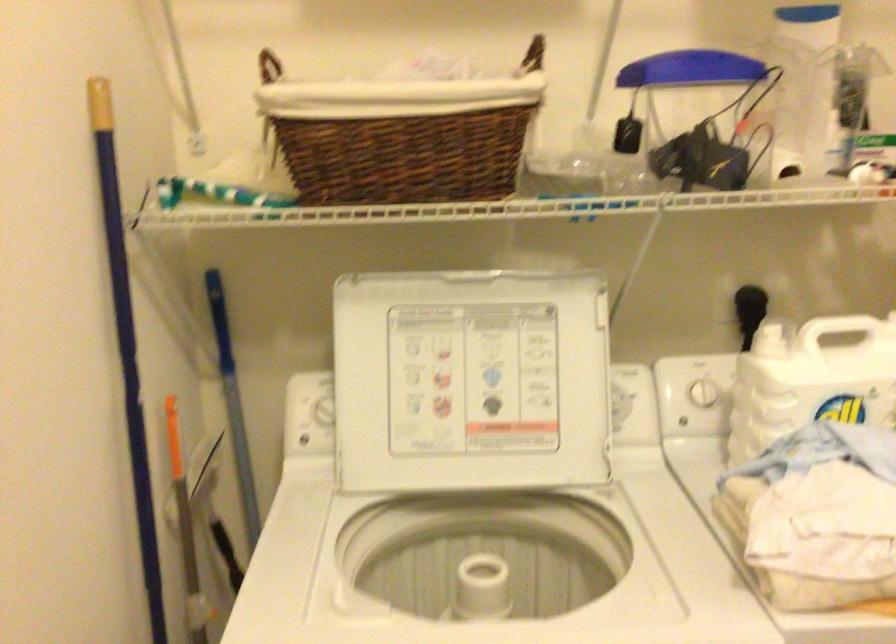
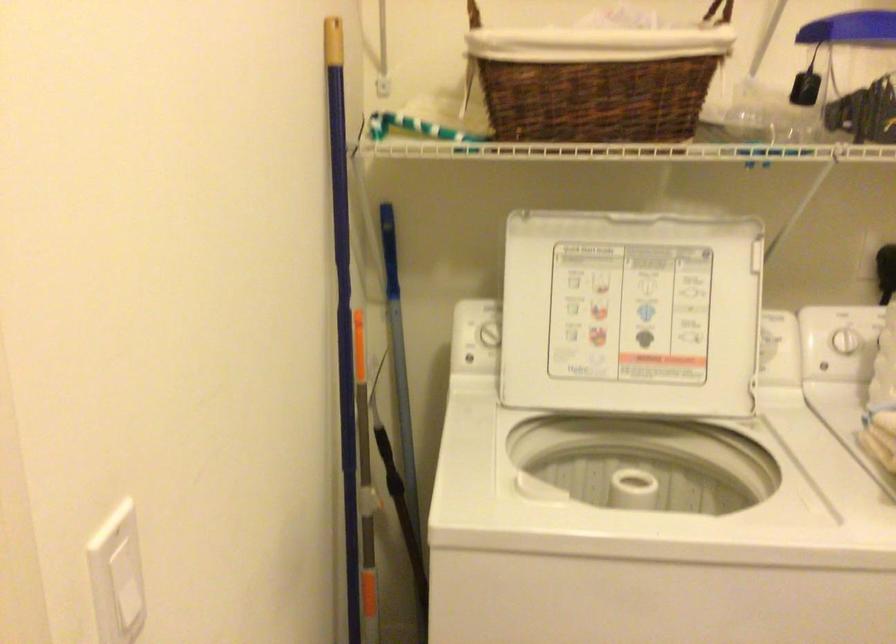
In the second image, find the point that corresponds to (x=136, y=410) in the first image.

(343, 316)